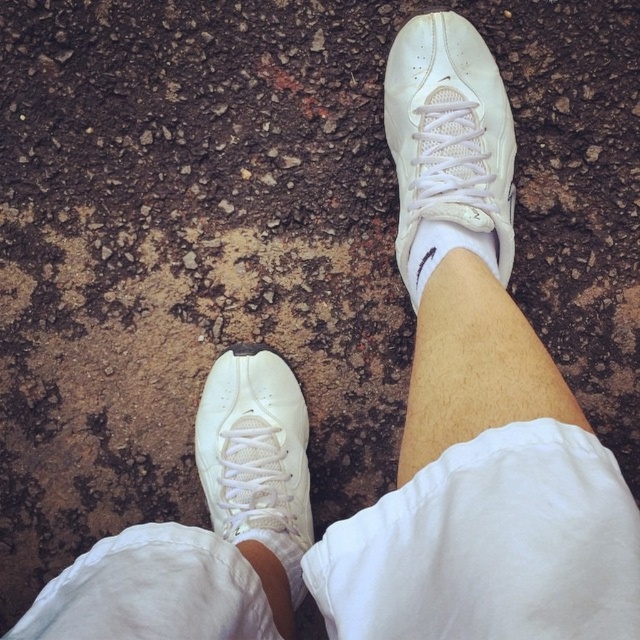
Question: Observing the image, what is the correct spatial positioning of white leather sneaker at center in reference to white matte skin at center?

Choices:
 (A) above
 (B) below

Answer: (B)

Question: Is white leather sneaker at center positioned before white matte skin at center?

Choices:
 (A) no
 (B) yes

Answer: (A)

Question: Estimate the real-world distances between objects in this image. Which object is farther from the white matte skin at center?

Choices:
 (A) white mesh shoe at center
 (B) white smooth skin at lower center

Answer: (B)

Question: Which object appears closest to the camera in this image?

Choices:
 (A) white leather sneaker at center
 (B) white smooth skin at lower center
 (C) white mesh shoe at center

Answer: (B)

Question: Does white leather sneaker at center appear on the right side of white smooth skin at lower center?

Choices:
 (A) yes
 (B) no

Answer: (B)

Question: Which point is farther from the camera taking this photo?

Choices:
 (A) (458, 228)
 (B) (269, 602)

Answer: (A)